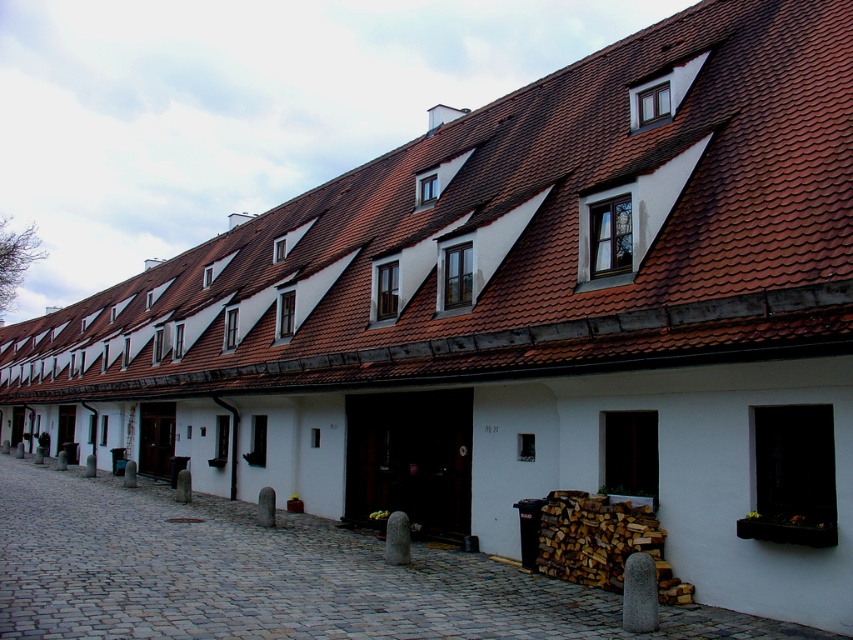
You are a delivery person trying to deliver a package to the house with the brown tile roof at center. The cobblestone alley at center is narrow. Can you drive your delivery van through the alley to reach the house?

The brown tile roof at center is positioned over cobblestone alley at center, meaning the alley is beneath the roof. Since the alley is narrow and the roof is overhead, the delivery van might not have enough clearance to pass through safely. It is advisable to find an alternative route or parking spot nearby.

You are a delivery person trying to park your 2.5 meter wide delivery van in the cobblestone alley at center. The brown tile roof at center is directly above the alley. Can the van fit through the alley without hitting the roof?

The brown tile roof at center is larger in size than the cobblestone alley at center, which means the alley is narrower than the roof. Since the van is 2.5 meters wide, it might not fit through the alley if the alley is narrower than 2.5 meters. However, the description does not provide exact measurements of the alley width, so it is uncertain.